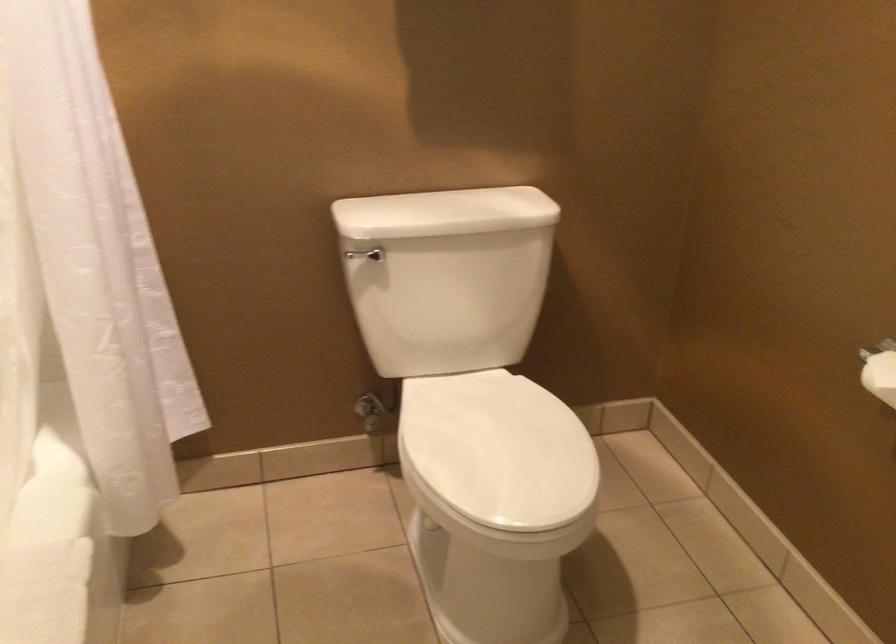
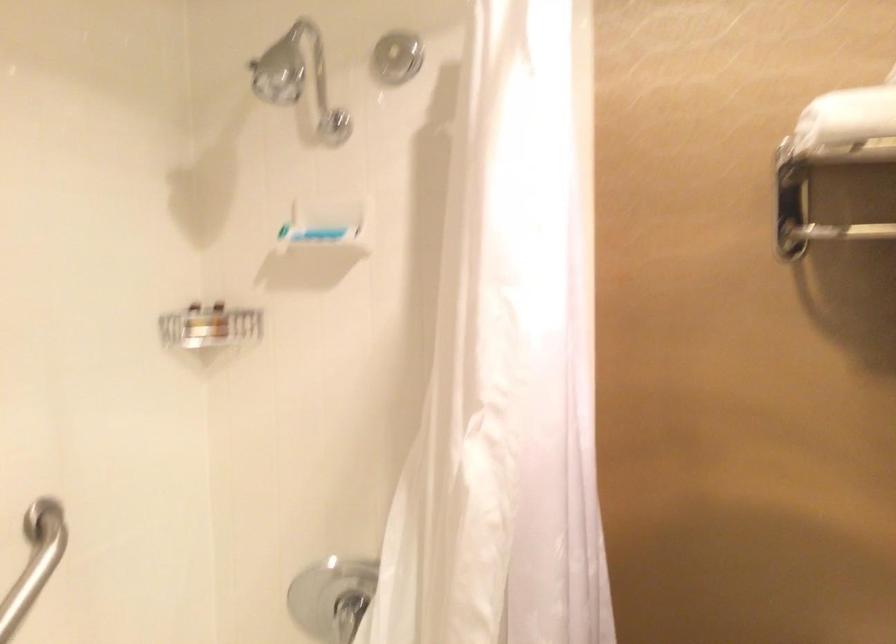
How did the camera likely rotate?

The camera rotated toward left-up.